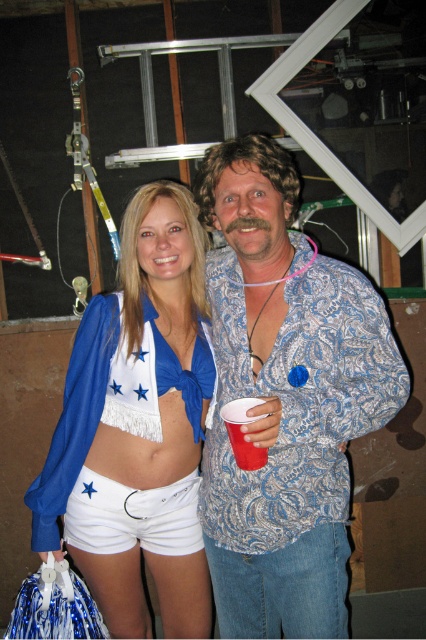
Question: Is paisley-patterned shirt at center further to the viewer compared to white cotton shorts at center?

Choices:
 (A) no
 (B) yes

Answer: (A)

Question: Estimate the real-world distances between objects in this image. Which object is farther from the paisley-patterned shirt at center?

Choices:
 (A) white fringed top at center
 (B) white cotton shorts at center

Answer: (B)

Question: Among these objects, which one is farthest from the camera?

Choices:
 (A) blue fringed bikini top at center
 (B) white fabric at lower left
 (C) red plastic cup at center

Answer: (B)

Question: Among these objects, which one is farthest from the camera?

Choices:
 (A) white fringed top at center
 (B) white fabric at lower left
 (C) blue fringed bikini top at center

Answer: (B)

Question: Does white cotton shorts at center appear over red plastic cup at center?

Choices:
 (A) yes
 (B) no

Answer: (B)

Question: Can you confirm if paisley-patterned shirt at center is bigger than white fabric at lower left?

Choices:
 (A) yes
 (B) no

Answer: (A)